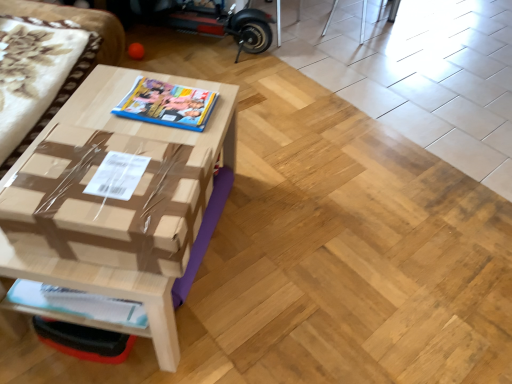
Question: Which is correct: white glossy magazine at lower left, arranged as the second magazine when viewed from the back, is inside brown cardboard box at center, or outside of it?

Choices:
 (A) inside
 (B) outside

Answer: (B)

Question: From their relative heights in the image, would you say white glossy magazine at lower left, acting as the second magazine starting from the top, is taller or shorter than brown cardboard box at center?

Choices:
 (A) short
 (B) tall

Answer: (A)

Question: Which of these objects is positioned closest to the white glossy magazine at lower left, acting as the second magazine starting from the top?

Choices:
 (A) matte plastic magazine at center, which is counted as the first magazine, starting from the back
 (B) brown cardboard couch at left
 (C) brown cardboard box at center
 (D) brown cardboard table at center

Answer: (C)

Question: Based on their relative distances, which object is farther from the white glossy magazine at lower left, marked as the 1th magazine in a front-to-back arrangement?

Choices:
 (A) brown cardboard table at center
 (B) brown cardboard box at center
 (C) matte plastic magazine at center, which is the second magazine from bottom to top
 (D) brown cardboard couch at left

Answer: (D)